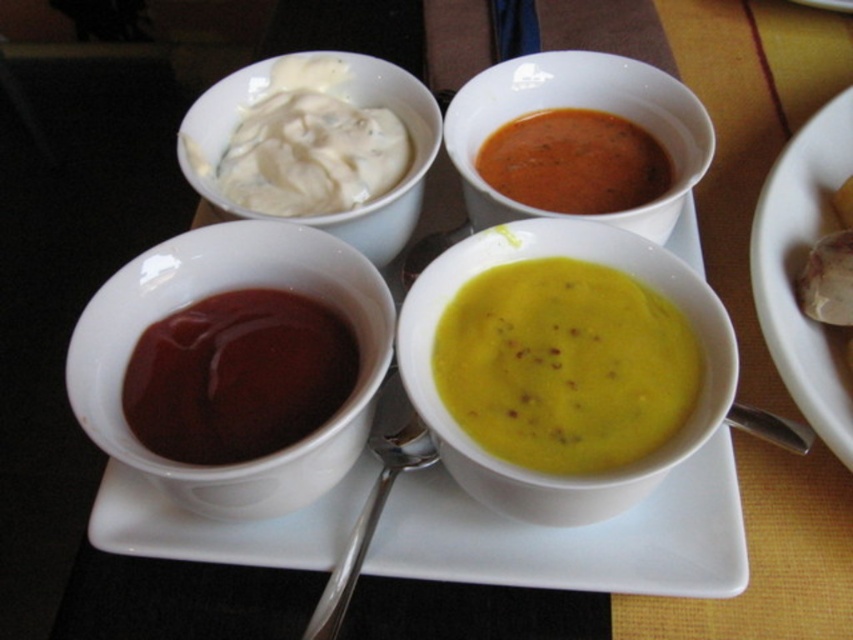
Between matte ceramic soup bowl at upper center and silver metallic spoon at lower center, which one has more height?

Standing taller between the two is matte ceramic soup bowl at upper center.

Is matte ceramic soup bowl at upper center thinner than silver metallic spoon at lower center?

Incorrect, matte ceramic soup bowl at upper center's width is not less than silver metallic spoon at lower center's.

At what (x,y) coordinates should I click in order to perform the action: click on matte ceramic soup bowl at upper center. Please return your answer as a coordinate pair (x, y). The image size is (853, 640). Looking at the image, I should click on (579, 108).

Locate an element on the screen. The image size is (853, 640). matte ceramic soup bowl at upper center is located at coordinates (579, 108).

From the picture: Can you confirm if matte ceramic sauce at left is positioned above matte ceramic soup bowl at upper center?

No.

Does matte ceramic sauce at left have a lesser width compared to matte ceramic soup bowl at upper center?

In fact, matte ceramic sauce at left might be wider than matte ceramic soup bowl at upper center.

What are the coordinates of `matte ceramic sauce at left` in the screenshot? It's located at (213, 292).

Find the location of a particular element. The width and height of the screenshot is (853, 640). matte ceramic sauce at left is located at coordinates (213, 292).

Can you confirm if matte ceramic soup bowl at upper center is smaller than matte white bowl at upper right?

Indeed, matte ceramic soup bowl at upper center has a smaller size compared to matte white bowl at upper right.

Between matte ceramic soup bowl at upper center and matte white bowl at upper right, which one has more height?

With more height is matte white bowl at upper right.

Which is in front, point (653, 81) or point (830, 145)?

Point (653, 81) is in front.

You are a GUI agent. You are given a task and a screenshot of the screen. Output one action in this format:
    pyautogui.click(x=<x>, y=<y>)
    Task: Click on the matte ceramic soup bowl at upper center
    
    Given the screenshot: What is the action you would take?
    pyautogui.click(x=579, y=108)